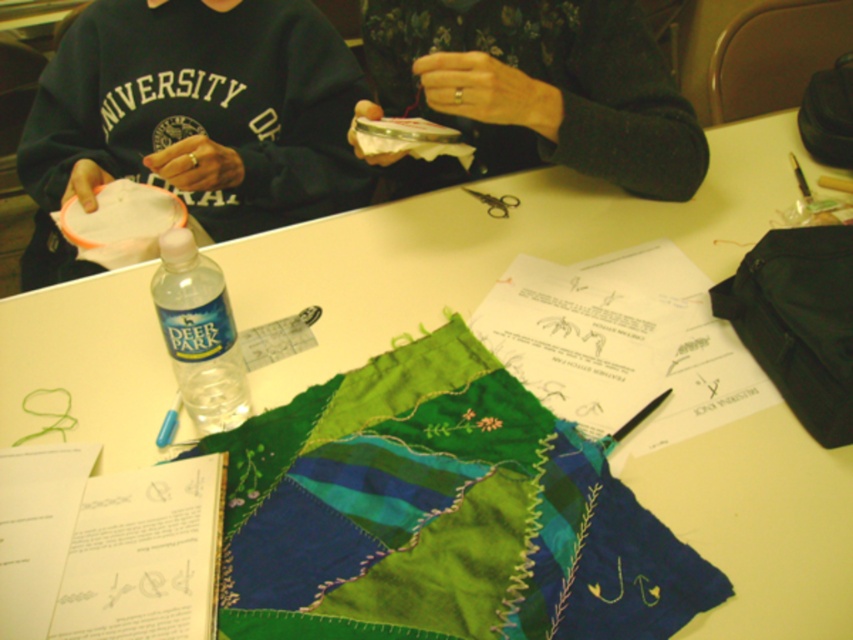
You are an observer looking at the table. Which object is positioned higher between the textured green fabric at center and the clear plastic bottle at center?

The clear plastic bottle at center is positioned higher than the textured green fabric at center.

You are looking at the crafting table and see two points marked on the table. The first point is at coordinate point (645, 54) and the second is at point (230, 352). Which point is closer to you?

Point (645, 54) is closer to you than point (230, 352) because it is further to the viewer.

You are an observer looking at the crafting table. You notice the textured green fabric at center and the clear plastic bottle at center. Which object is taller?

The textured green fabric at center is taller than the clear plastic bottle at center.